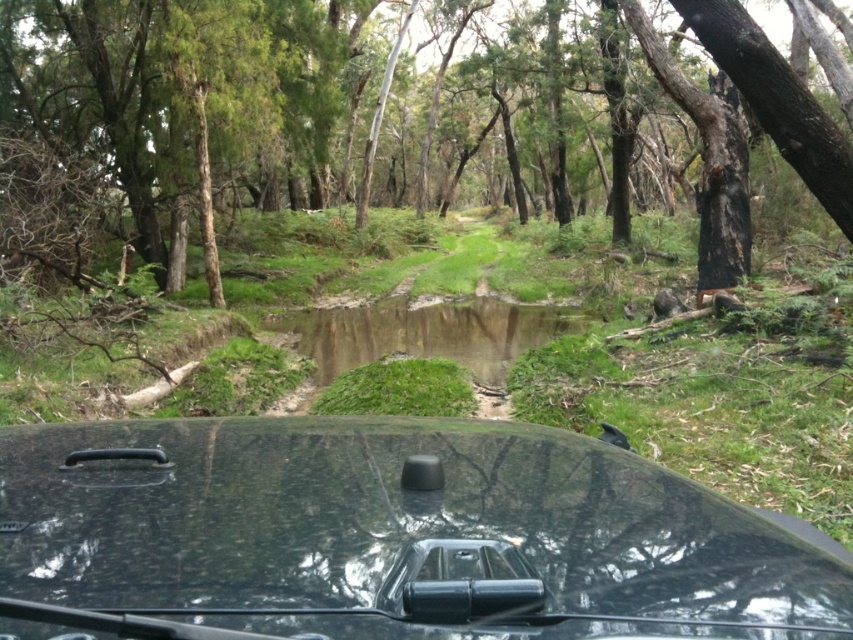
You are driving a glossy black car at center and want to continue on the path ahead. There is a brown rough tree at center blocking your way. Can you drive around it on the path? Explain why using the scene details.

The brown rough tree at center is above the glossy black car at center, meaning the tree is positioned over the car. Since the car is stationary and the tree is above it, you cannot drive around the tree on the path because the tree is blocking the path directly ahead.

You are driving a car and want to avoid hitting the brown rough tree at center. According to the coordinates provided, where exactly is the brown rough tree located in relation to the car?

The brown rough tree at center is located at coordinates point (x=370, y=120), which means it is positioned to the left and slightly forward of the car, so you should steer to the right to avoid it.